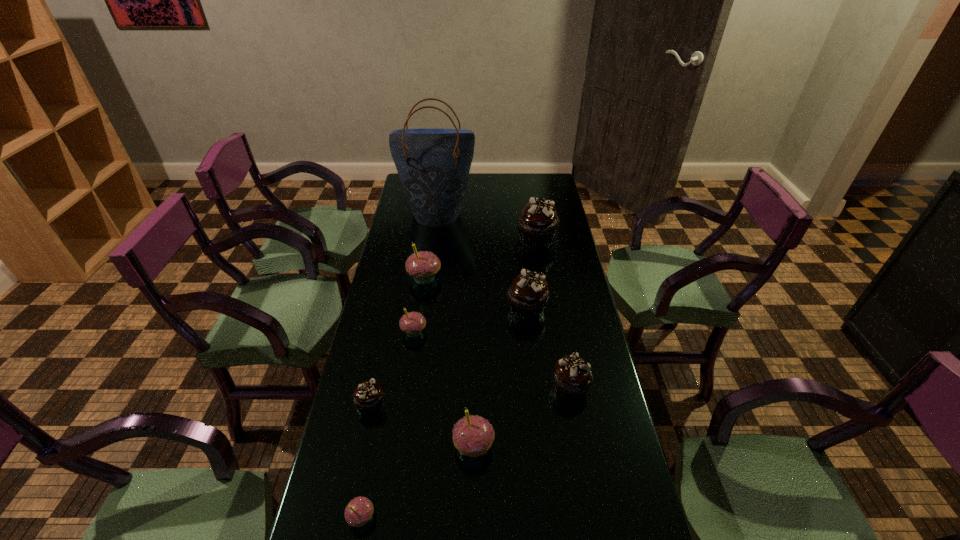
You are a GUI agent. You are given a task and a screenshot of the screen. Output one action in this format:
    pyautogui.click(x=<x>, y=<y>)
    Task: Click on the free space located on the front of the third biggest brown cupcake
    
    Given the screenshot: What is the action you would take?
    pyautogui.click(x=588, y=492)

This screenshot has height=540, width=960. Identify the location of blank space located on the front of the smallest brown cupcake. (358, 461).

At what (x,y) coordinates should I click in order to perform the action: click on vacant point located 0.290m on the back of the nearest object. Please return your answer as a coordinate pair (x, y). Looking at the image, I should click on (384, 397).

Where is `shopping bag that is at the left edge`? shopping bag that is at the left edge is located at coordinates (433, 165).

Identify the location of vacant space at the far edge. This screenshot has width=960, height=540. (484, 186).

Where is `vacant space at the left edge of the desktop`? The image size is (960, 540). vacant space at the left edge of the desktop is located at coordinates (382, 381).

In the image, there is a desktop. At what (x,y) coordinates should I click in order to perform the action: click on vacant area at the right edge. Please return your answer as a coordinate pair (x, y). The height and width of the screenshot is (540, 960). Looking at the image, I should click on (556, 243).

Image resolution: width=960 pixels, height=540 pixels. Find the location of `free spot between the smallest brown cupcake and the seventh nearest object`. free spot between the smallest brown cupcake and the seventh nearest object is located at coordinates (397, 341).

Locate an element on the screen. Image resolution: width=960 pixels, height=540 pixels. vacant space that is in between the nearest object and the seventh nearest object is located at coordinates (393, 398).

Image resolution: width=960 pixels, height=540 pixels. In order to click on free point between the rightmost pink cupcake and the second smallest brown cupcake in this screenshot , I will do `click(522, 417)`.